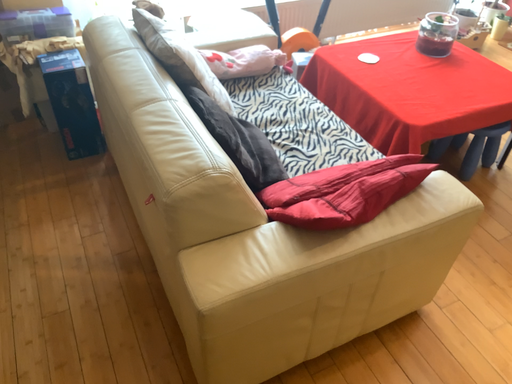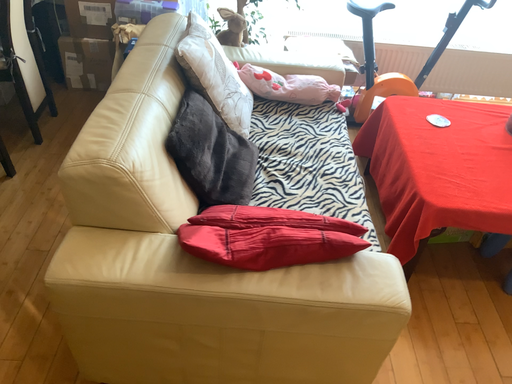
Question: Which way did the camera rotate in the video?

Choices:
 (A) rotated left
 (B) rotated right

Answer: (A)